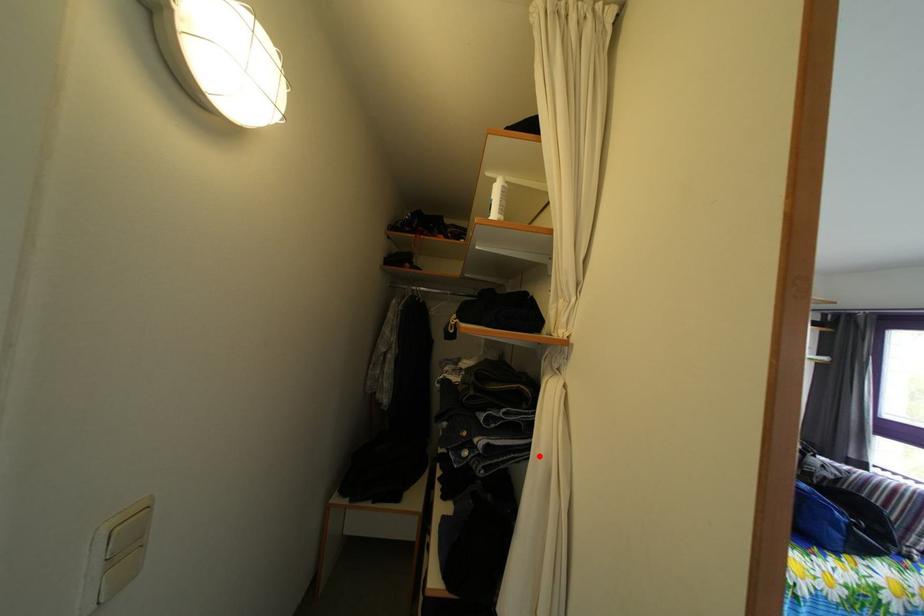
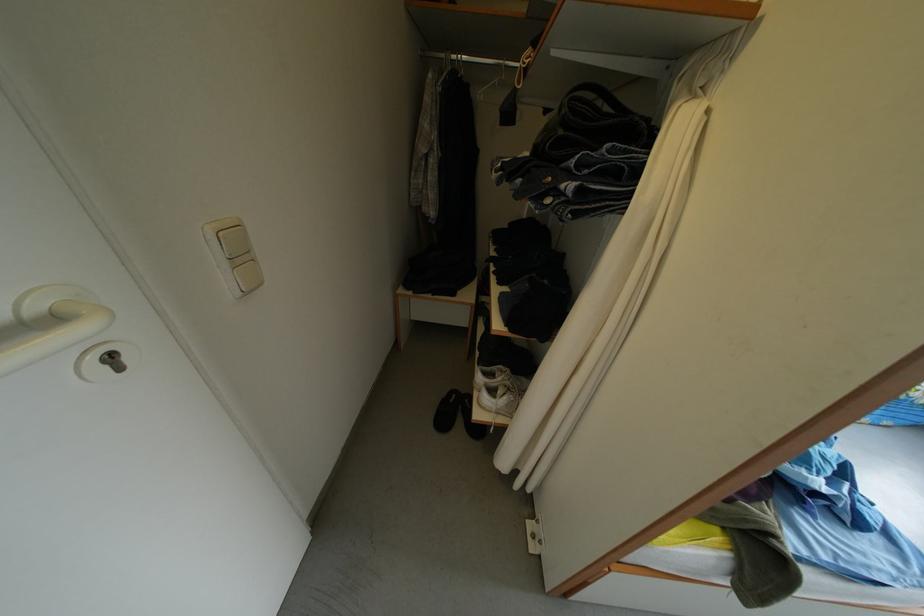
Locate, in the second image, the point that corresponds to the highlighted location in the first image.

(639, 204)